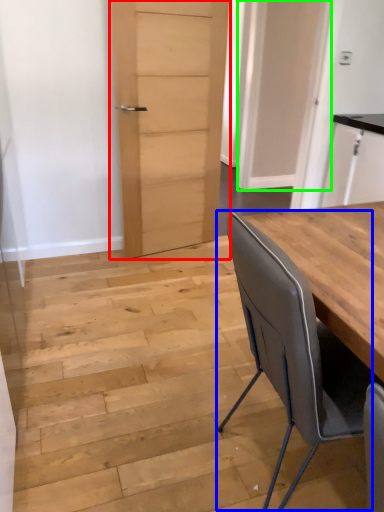
Question: Based on their relative distances, which object is nearer to door (highlighted by a red box)? Choose from chair (highlighted by a blue box) and door (highlighted by a green box).

Choices:
 (A) chair
 (B) door

Answer: (B)